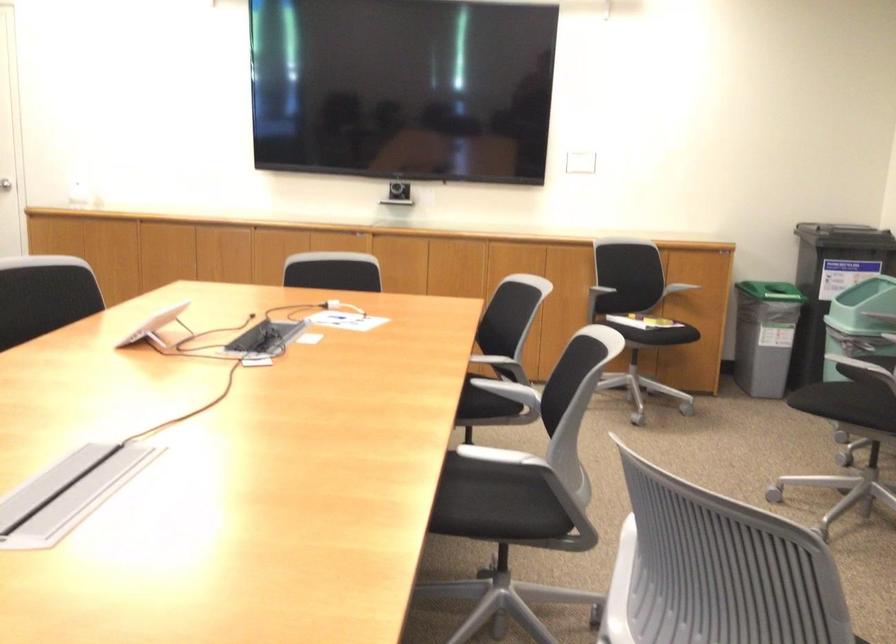
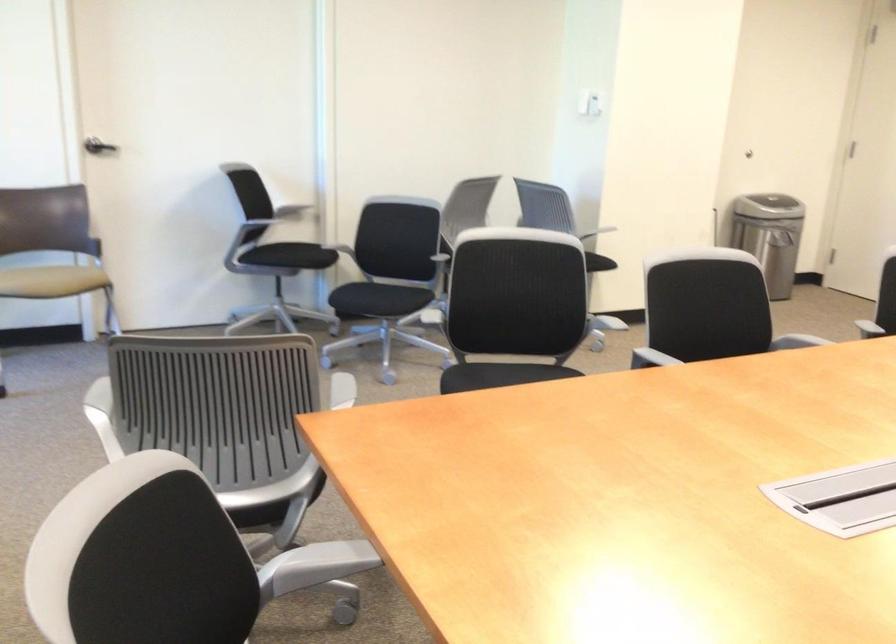
Question: Based on the continuous images, in which direction is the camera rotating? Reply with the corresponding letter.

Choices:
 (A) Left
 (B) Right
 (C) Up
 (D) Down

Answer: (A)